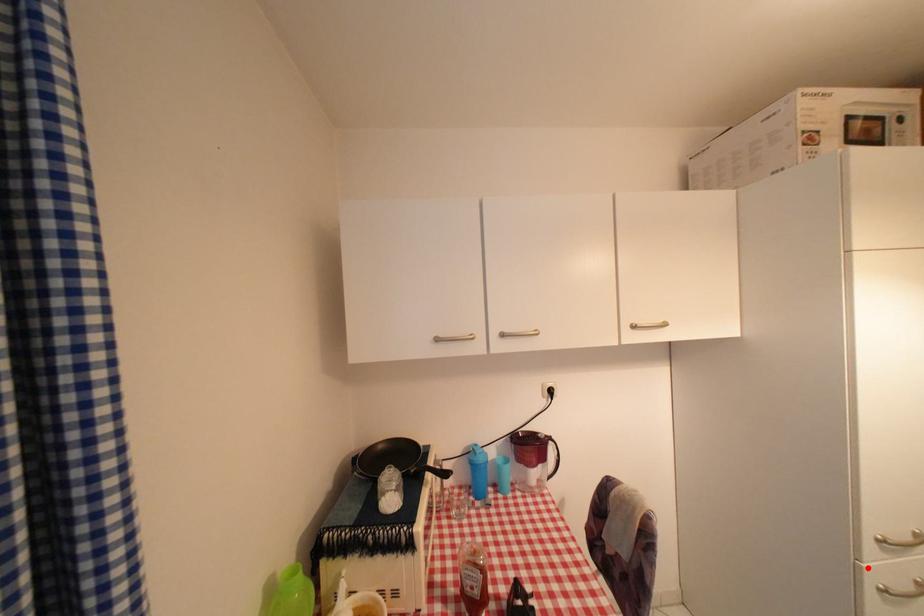
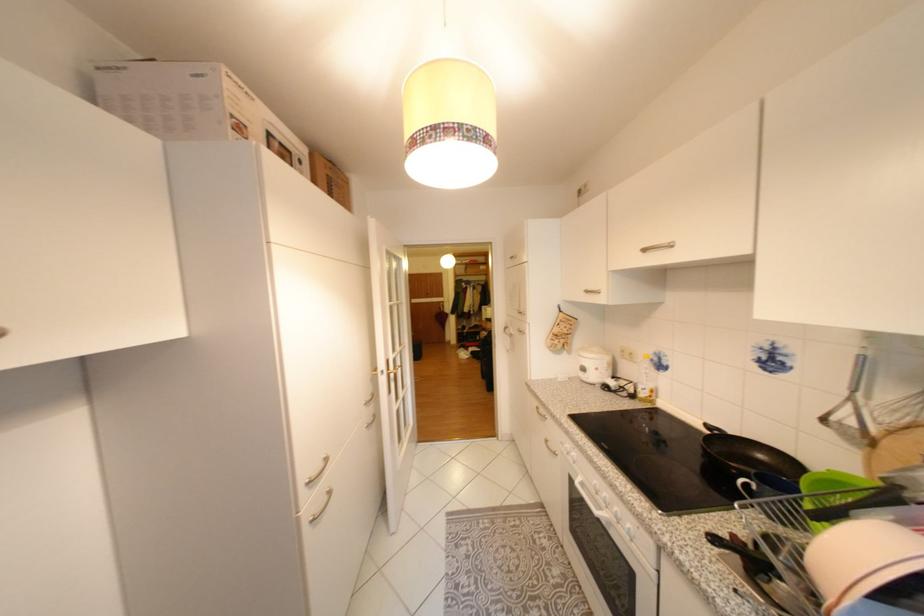
Question: I am providing you with two images of the same scene from different viewpoints. Given a red point in image1, look at the same physical point in image2. Is it:

Choices:
 (A) Closer to the viewpoint
 (B) Farther from the viewpoint

Answer: (B)